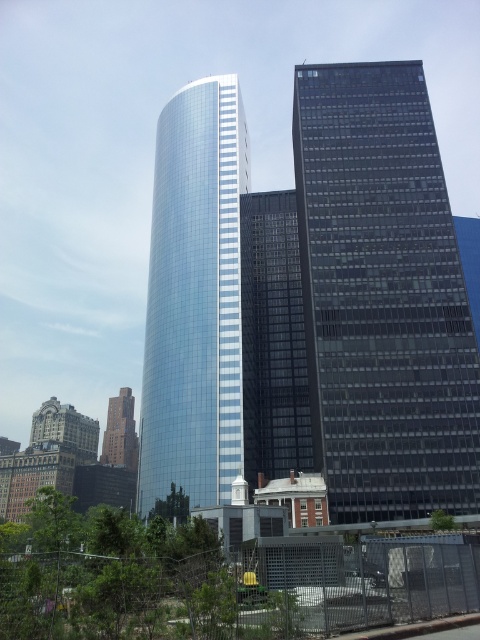
You are a drone operator trying to navigate between the dark glass skyscraper at right and the glossy glass tower at center. Based on their positions, which building is higher in the image?

The dark glass skyscraper at right is located above the glossy glass tower at center, so it appears higher in the image.

You are a city planner reviewing this area. You need to determine if the dark glass skyscraper at right can be seen from the brick building at lower left. Based on their positions, what do you conclude?

The dark glass skyscraper at right is located above the brick building at lower left, so it can be seen from there.

You are a drone operator who needs to fly a drone from the dark glass skyscraper at right to the brick building at lower left. Considering their heights, which building should you start your descent earlier?

The dark glass skyscraper at right is taller than the brick building at lower left. Therefore, you should start your descent earlier when approaching the brick building at lower left since it is shorter.